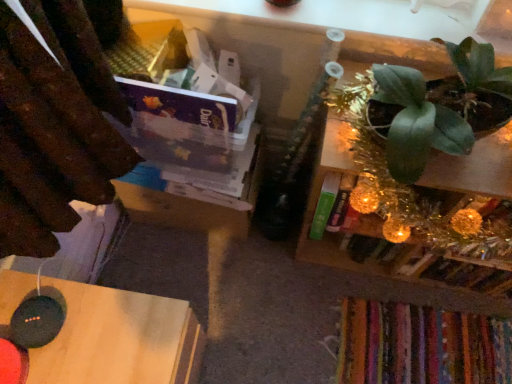
Question: From a real-world perspective, is green matte plant at upper right on green metallic plant at upper right?

Choices:
 (A) no
 (B) yes

Answer: (B)

Question: Is green matte plant at upper right positioned beyond the bounds of green metallic plant at upper right?

Choices:
 (A) yes
 (B) no

Answer: (A)

Question: From the image's perspective, is green matte plant at upper right located above green metallic plant at upper right?

Choices:
 (A) yes
 (B) no

Answer: (A)

Question: Is green matte plant at upper right smaller than green metallic plant at upper right?

Choices:
 (A) no
 (B) yes

Answer: (B)

Question: Is green matte plant at upper right to the left of green metallic plant at upper right from the viewer's perspective?

Choices:
 (A) yes
 (B) no

Answer: (A)

Question: Looking at the image, does green metallic plant at upper right seem bigger or smaller compared to green matte plant at upper right?

Choices:
 (A) small
 (B) big

Answer: (B)

Question: Relative to green matte plant at upper right, is green metallic plant at upper right in front or behind?

Choices:
 (A) behind
 (B) front

Answer: (A)

Question: Looking at their shapes, would you say green metallic plant at upper right is wider or thinner than green matte plant at upper right?

Choices:
 (A) thin
 (B) wide

Answer: (A)

Question: From the image's perspective, is green metallic plant at upper right above or below green matte plant at upper right?

Choices:
 (A) above
 (B) below

Answer: (B)

Question: Visually, is black wood table at lower left positioned to the left or to the right of green metallic plant at upper right?

Choices:
 (A) left
 (B) right

Answer: (A)

Question: Which is correct: black wood table at lower left is inside green metallic plant at upper right, or outside of it?

Choices:
 (A) outside
 (B) inside

Answer: (A)

Question: Considering their positions, is black wood table at lower left located in front of or behind green metallic plant at upper right?

Choices:
 (A) front
 (B) behind

Answer: (A)

Question: From a real-world perspective, relative to green metallic plant at upper right, is black wood table at lower left vertically above or below?

Choices:
 (A) below
 (B) above

Answer: (A)

Question: Is point (374, 178) positioned closer to the camera than point (124, 375)?

Choices:
 (A) farther
 (B) closer

Answer: (A)

Question: In terms of height, does green metallic plant at upper right look taller or shorter compared to black wood table at lower left?

Choices:
 (A) tall
 (B) short

Answer: (A)